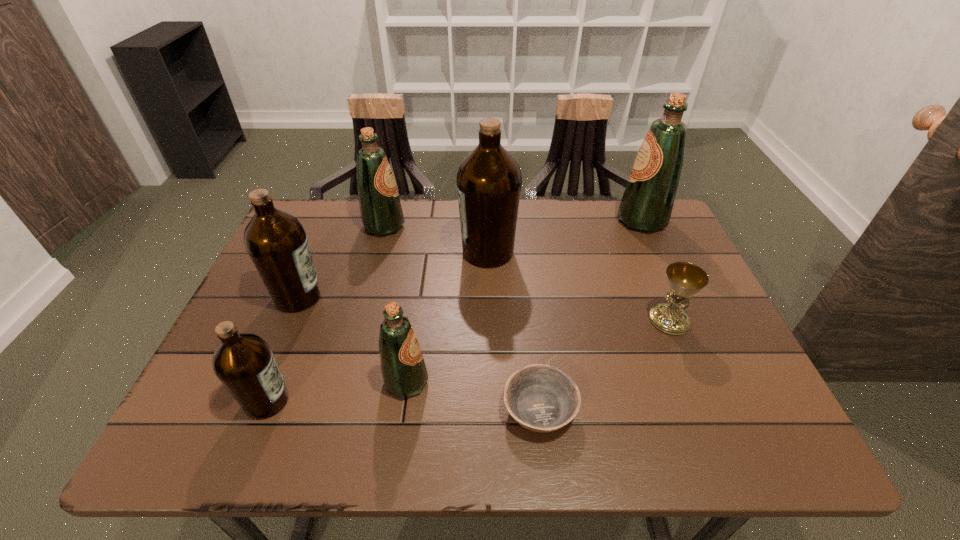
The image size is (960, 540). Identify the location of empty location between the third nearest olive oil and the fourth olive oil from left to right. (352, 339).

You are a GUI agent. You are given a task and a screenshot of the screen. Output one action in this format:
    pyautogui.click(x=<x>, y=<y>)
    Task: Click on the unoccupied position between the farthest brown olive oil and the fifth object from right to left
    The image size is (960, 540).
    Given the screenshot: What is the action you would take?
    pyautogui.click(x=447, y=317)

The width and height of the screenshot is (960, 540). I want to click on blank region between the chalice and the bowl, so click(x=605, y=364).

Where is `free space between the second biggest brown olive oil and the fifth olive oil from left to right`? This screenshot has height=540, width=960. free space between the second biggest brown olive oil and the fifth olive oil from left to right is located at coordinates (393, 274).

What are the coordinates of `object that stands as the sixth closest to the smallest brown olive oil` in the screenshot? It's located at (685, 279).

This screenshot has height=540, width=960. I want to click on object that is the third closest one to the second biggest brown olive oil, so click(x=404, y=372).

Point out which olive oil is positioned as the fourth nearest to the leftmost green olive oil. Please provide its 2D coordinates. Your answer should be formatted as a tuple, i.e. [(x, y)], where the tuple contains the x and y coordinates of a point satisfying the conditions above.

[(244, 363)]

Locate an element on the screen. This screenshot has width=960, height=540. olive oil that is the fourth closest to the fourth olive oil from right to left is located at coordinates (244, 363).

Where is `brown olive oil that stands as the closest to the second smallest brown olive oil`? This screenshot has height=540, width=960. brown olive oil that stands as the closest to the second smallest brown olive oil is located at coordinates (244, 363).

Locate an element on the screen. This screenshot has height=540, width=960. brown olive oil that is the third closest to the third object from left to right is located at coordinates (244, 363).